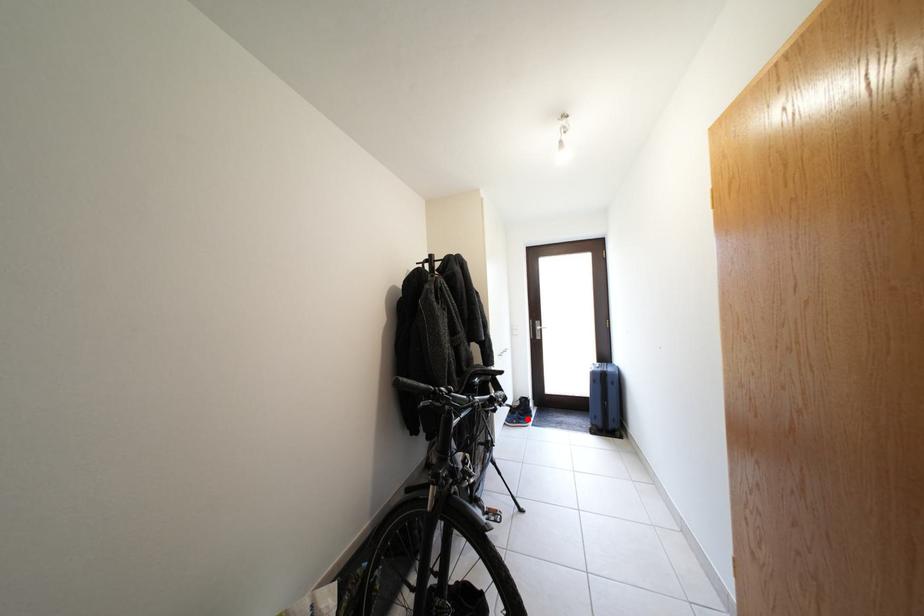
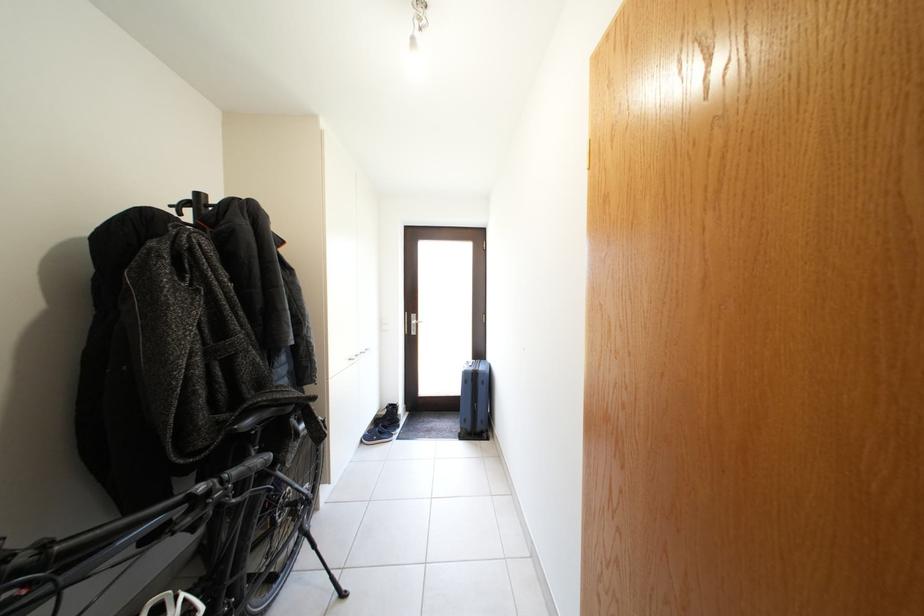
The point at the highlighted location is marked in the first image. Where is the corresponding point in the second image?

(392, 431)